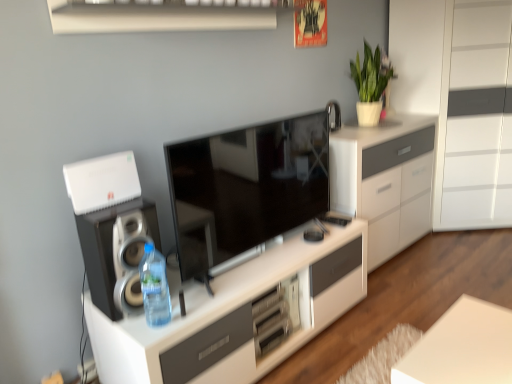
Question: Is matte black tv at center at the right side of white matte plant at upper right?

Choices:
 (A) yes
 (B) no

Answer: (B)

Question: Considering the relative sizes of matte black tv at center and white matte plant at upper right in the image provided, is matte black tv at center bigger than white matte plant at upper right?

Choices:
 (A) yes
 (B) no

Answer: (A)

Question: From a real-world perspective, is matte black tv at center positioned under white matte plant at upper right based on gravity?

Choices:
 (A) yes
 (B) no

Answer: (A)

Question: Is matte black tv at center at the left side of white matte plant at upper right?

Choices:
 (A) yes
 (B) no

Answer: (A)

Question: Is matte black tv at center oriented away from white matte plant at upper right?

Choices:
 (A) no
 (B) yes

Answer: (A)

Question: Would you say white matte plant at upper right is part of matte black tv at center's contents?

Choices:
 (A) no
 (B) yes

Answer: (A)

Question: Does matte black speaker at left have a smaller size compared to white matte plant at upper right?

Choices:
 (A) yes
 (B) no

Answer: (A)

Question: Considering the relative sizes of matte black speaker at left and white matte plant at upper right in the image provided, is matte black speaker at left thinner than white matte plant at upper right?

Choices:
 (A) yes
 (B) no

Answer: (A)

Question: From the image's perspective, is matte black speaker at left over white matte plant at upper right?

Choices:
 (A) yes
 (B) no

Answer: (B)

Question: From a real-world perspective, is matte black speaker at left under white matte plant at upper right?

Choices:
 (A) yes
 (B) no

Answer: (A)

Question: Is matte black speaker at left not inside white matte plant at upper right?

Choices:
 (A) yes
 (B) no

Answer: (A)

Question: From the image's perspective, does matte black speaker at left appear lower than white matte plant at upper right?

Choices:
 (A) no
 (B) yes

Answer: (B)

Question: Is white glossy cabinet at right further to camera compared to white matte table at lower right?

Choices:
 (A) yes
 (B) no

Answer: (A)